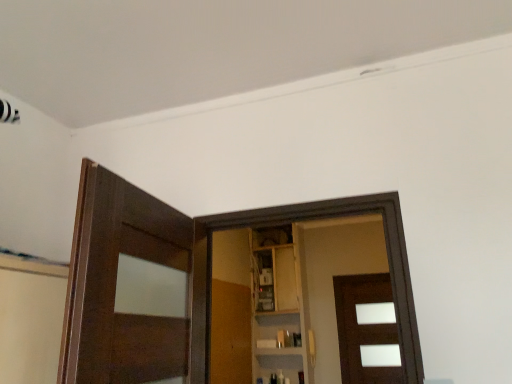
The width and height of the screenshot is (512, 384). I want to click on brown matte door at center, so click(367, 330).

Find the location of `wooden at center`. wooden at center is located at coordinates (231, 308).

This screenshot has width=512, height=384. What do you see at coordinates (279, 308) in the screenshot? I see `wooden cabinet at center` at bounding box center [279, 308].

The height and width of the screenshot is (384, 512). Find the location of `brown matte door at center`. brown matte door at center is located at coordinates coord(367,330).

From the image's perspective, between wooden at center and wooden cabinet at center, which one is located above?

wooden cabinet at center, from the image's perspective.

The height and width of the screenshot is (384, 512). I want to click on barn door in front of the wooden cabinet at center, so click(231, 308).

Could you tell me if wooden at center is turned towards wooden cabinet at center?

No.

How many degrees apart are the facing directions of wooden cabinet at center and wooden at center?

The facing directions of wooden cabinet at center and wooden at center are 91 degrees apart.

Which is more to the right, wooden cabinet at center or wooden at center?

Positioned to the right is wooden cabinet at center.

Relative to wooden at center, is wooden cabinet at center in front or behind?

Visually, wooden cabinet at center is located behind wooden at center.

Consider the image. Considering the relative sizes of wooden cabinet at center and wooden at center in the image provided, is wooden cabinet at center shorter than wooden at center?

No, wooden cabinet at center is not shorter than wooden at center.

Considering the relative sizes of wooden at center and brown matte door at center in the image provided, is wooden at center shorter than brown matte door at center?

No, wooden at center is not shorter than brown matte door at center.

Does point (212, 382) lie behind point (379, 291)?

No, (212, 382) is in front of (379, 291).

In the scene shown: Is wooden at center inside the boundaries of brown matte door at center, or outside?

wooden at center is not inside brown matte door at center, it's outside.

Between wooden at center and brown matte door at center, which one has larger size?

wooden at center.

Choose the correct answer: Is wooden cabinet at center inside brown matte door at center or outside it?

wooden cabinet at center is outside brown matte door at center.

Between wooden cabinet at center and brown matte door at center, which one has larger size?

wooden cabinet at center.

Is point (307, 306) closer or farther from the camera than point (360, 304)?

Point (307, 306).

Is wooden cabinet at center at the left side of brown matte door at center?

Yes, wooden cabinet at center is to the left of brown matte door at center.

Considering the sizes of brown matte door at center and wooden at center in the image, is brown matte door at center bigger or smaller than wooden at center?

Clearly, brown matte door at center is smaller in size than wooden at center.

From the image's perspective, does brown matte door at center appear lower than wooden at center?

Yes.

Which of these two, brown matte door at center or wooden at center, stands shorter?

Result: Standing shorter between the two is brown matte door at center.

Is brown matte door at center far away from wooden at center?

brown matte door at center is positioned a significant distance from wooden at center.

Are brown matte door at center and wooden cabinet at center far apart?

No, brown matte door at center is not far from wooden cabinet at center.

Is brown matte door at center surrounding wooden cabinet at center?

No, wooden cabinet at center is not a part of brown matte door at center.

Based on their sizes in the image, would you say brown matte door at center is bigger or smaller than wooden cabinet at center?

brown matte door at center is smaller than wooden cabinet at center.

This screenshot has height=384, width=512. I want to click on barn door in front of the wooden cabinet at center, so click(x=231, y=308).

Where is `barn door on the left side of wooden cabinet at center`? This screenshot has width=512, height=384. barn door on the left side of wooden cabinet at center is located at coordinates (231, 308).

When comparing their distances from wooden cabinet at center, does brown matte door at center or wooden at center seem closer?

wooden at center is positioned closer to the anchor wooden cabinet at center.

Estimate the real-world distances between objects in this image. Which object is further from wooden at center, brown matte door at center or wooden cabinet at center?

The object further to wooden at center is brown matte door at center.

From the image, which object appears to be farther from brown matte door at center, wooden at center or wooden cabinet at center?

wooden at center.

Which object lies nearer to the anchor point wooden cabinet at center, wooden at center or brown matte door at center?

wooden at center.

Looking at the image, which one is located further to wooden at center, wooden cabinet at center or brown matte door at center?

brown matte door at center.

Based on their spatial positions, is wooden cabinet at center or wooden at center closer to brown matte door at center?

wooden cabinet at center is closer to brown matte door at center.

Locate an element on the screen. This screenshot has height=384, width=512. cabinetry between wooden at center and brown matte door at center is located at coordinates (279, 308).